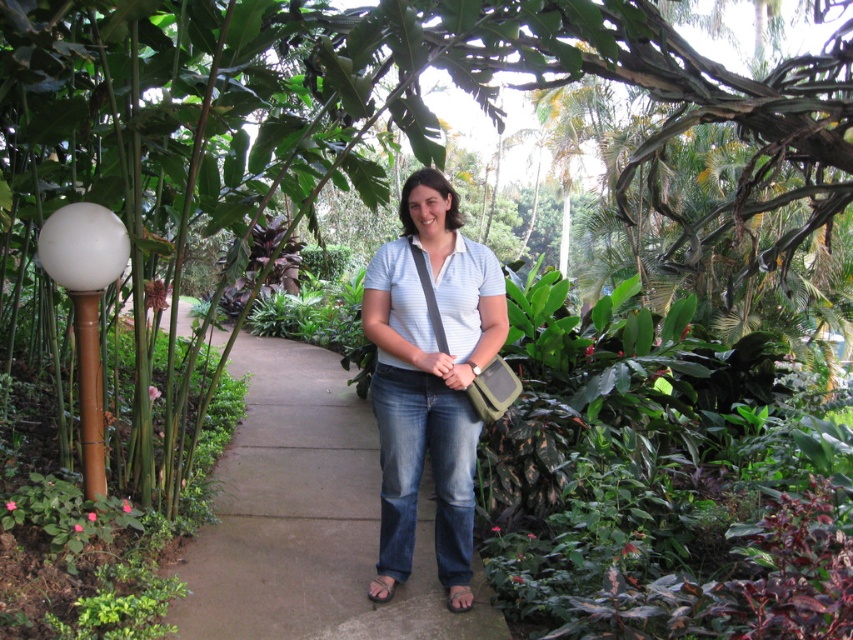
You are a photographer trying to capture a photo of the matte blue shirt at center and the gray concrete pavement at center. Since you want both objects in focus, which one should you adjust your camera focus on first?

The gray concrete pavement at center is to the left of matte blue shirt at center, so you should focus on the matte blue shirt at center first because it is closer to the camera.

You are a delivery person who needs to walk along the gray concrete pavement at center while carrying a box that is as wide as the matte blue shirt at center. Will the pavement be wide enough for you to walk safely without the box hanging over the edge?

The gray concrete pavement at center is narrower than the matte blue shirt at center. Since the box is as wide as the matte blue shirt at center, the pavement is not wide enough to accommodate the box safely. You should find a wider path or adjust your load.

You are a drone operator trying to capture a photo of the person in the scene. You have two points marked as potential camera positions. The first point is at point [225,620] and the second is at point [502,330]. Based on their positions, which point would allow you to capture the person without them being blocked by the vegetation?

Point [225,620] is in front of point [502,330], so capturing from point [225,620] would place the camera closer to the person and less likely to be obstructed by the surrounding vegetation.